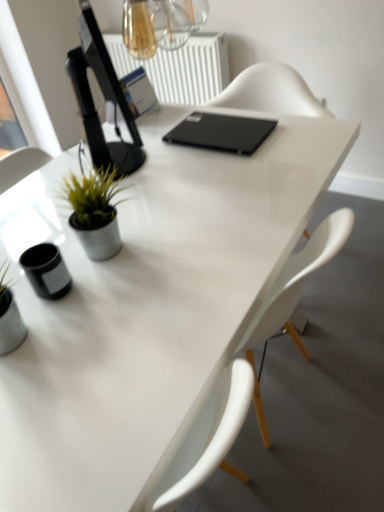
Locate an element on the screen. Image resolution: width=384 pixels, height=512 pixels. vacant region to the right of green matte plant at left is located at coordinates (168, 231).